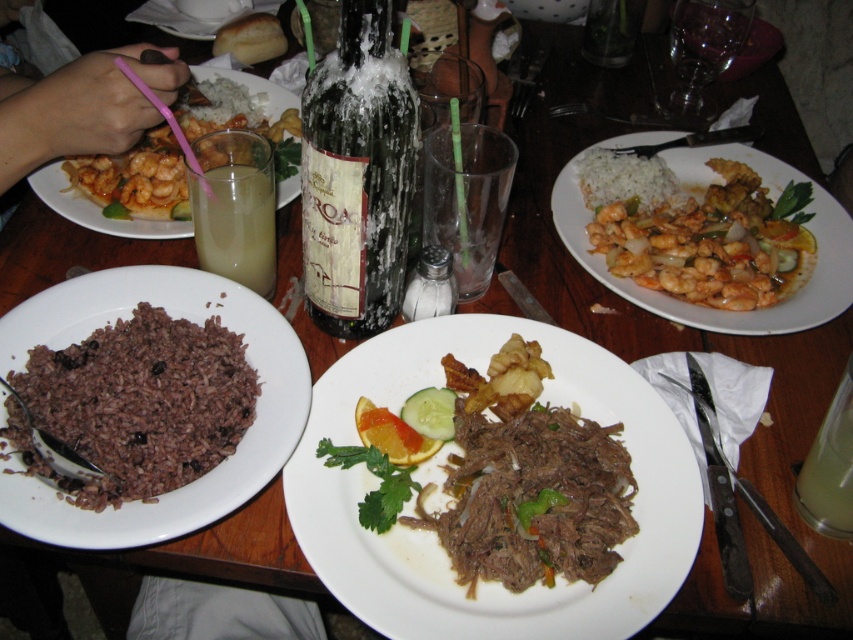
Question: Does shredded meat at center appear on the left side of brown matte bread at upper center?

Choices:
 (A) no
 (B) yes

Answer: (A)

Question: Which of the following is the closest to the observer?

Choices:
 (A) (242, 38)
 (B) (564, 444)
 (C) (262, 228)

Answer: (B)

Question: Which object is the closest to the shiny orange shrimp at upper left?

Choices:
 (A) white creamy rice at center
 (B) brown rice at left
 (C) bread at center

Answer: (C)

Question: Does shiny orange shrimp at right appear on the right side of bread at center?

Choices:
 (A) no
 (B) yes

Answer: (B)

Question: Is shiny orange shrimp at right thinner than yellow translucent liquid at center?

Choices:
 (A) yes
 (B) no

Answer: (B)

Question: Which object is farther from the camera taking this photo?

Choices:
 (A) brown matte bread at upper center
 (B) brown rice at left

Answer: (A)